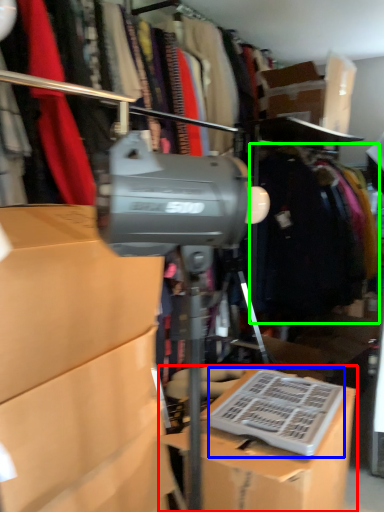
Question: Which is farther away from box (highlighted by a red box)? wide (highlighted by a blue box) or clothing (highlighted by a green box)?

Choices:
 (A) wide
 (B) clothing

Answer: (B)